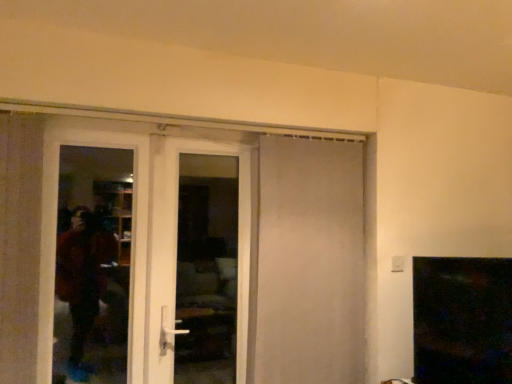
Question: Would you say white matte door at center, acting as the 1th door starting from the right, is to the left or to the right of white glossy door at left, marked as the 3th door in a right-to-left arrangement, in the picture?

Choices:
 (A) right
 (B) left

Answer: (A)

Question: Based on their sizes in the image, would you say white matte door at center, which appears as the third door when viewed from the left, is bigger or smaller than white glossy door at left, placed as the first door when sorted from left to right?

Choices:
 (A) big
 (B) small

Answer: (A)

Question: Which of these objects is positioned farthest from the white glossy door at center, which is the second door in right-to-left order?

Choices:
 (A) white glossy door at left, marked as the 3th door in a right-to-left arrangement
 (B) white matte door at center, which appears as the third door when viewed from the left
 (C) transparent glass screen door at left

Answer: (A)

Question: Which of these objects is positioned farthest from the white glossy door at left, marked as the 3th door in a right-to-left arrangement?

Choices:
 (A) transparent glass screen door at left
 (B) white matte door at center, which appears as the third door when viewed from the left
 (C) white glossy door at center, acting as the second door starting from the left

Answer: (A)